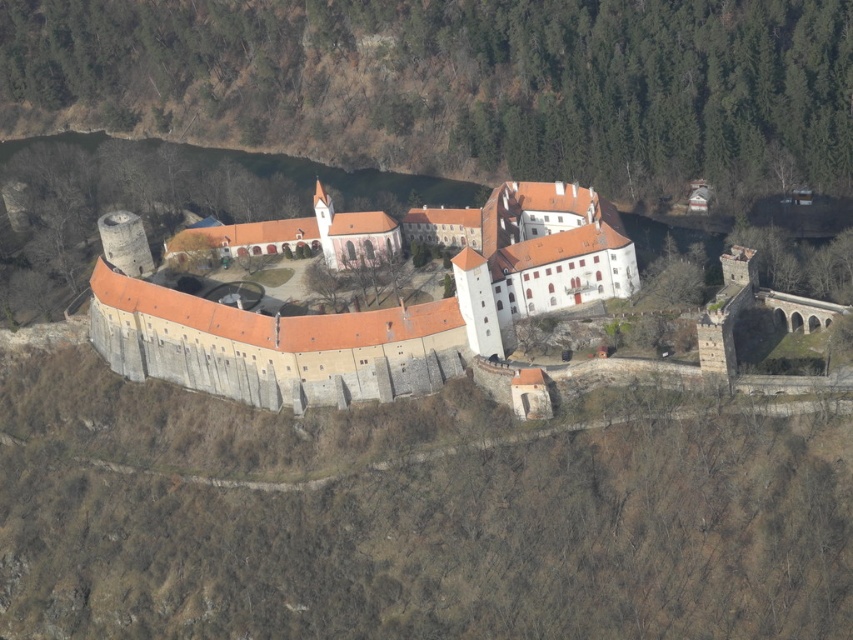
You are a drone operator trying to capture the best aerial shot of the brown stone castle at center and the white stone monastery at center. Which structure should you focus on to ensure it appears taller in the photo?

The brown stone castle at center has a greater height compared to the white stone monastery at center, so focusing on it will make it appear taller in the photo.

You are a drone operator flying over a historic site. Your mission is to capture aerial footage of the brown stone castle at center and the white stone monastery at center. From the drone camera perspective, which structure appears to be on the left side?

The brown stone castle at center is positioned on the left side of the white stone monastery at center, so from the drone camera perspective, the brown stone castle at center appears to be on the left side.

You are a drone operator tasked with capturing aerial footage of the brown stone castle at center and the white stone monastery at center. The drone has a maximum horizontal flight range of 50 meters. If the distance between the two structures is 30 meters, can the drone capture both structures in a single shot without moving?

The distance between the brown stone castle at center and the white stone monastery at center is 30 meters, which is within the drone operator s maximum horizontal flight range of 50 meters. Therefore, the drone can capture both structures in a single shot without moving.